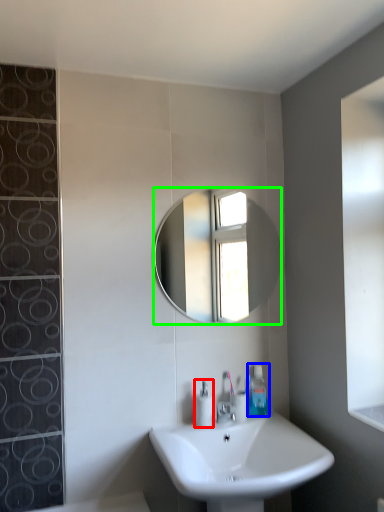
Question: Estimate the real-world distances between objects in this image. Which object is farther from soap dispenser (highlighted by a red box), toiletry (highlighted by a blue box) or mirror (highlighted by a green box)?

Choices:
 (A) toiletry
 (B) mirror

Answer: (B)